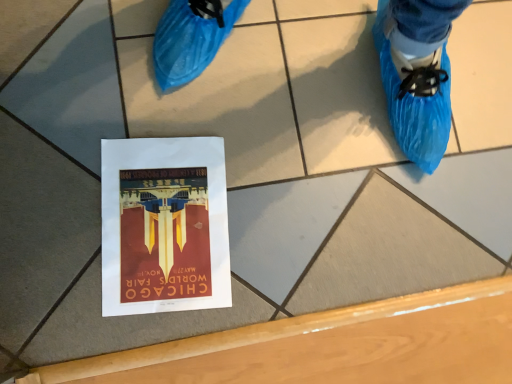
This screenshot has width=512, height=384. I want to click on free point below matte paper poster at center (from a real-world perspective), so click(166, 223).